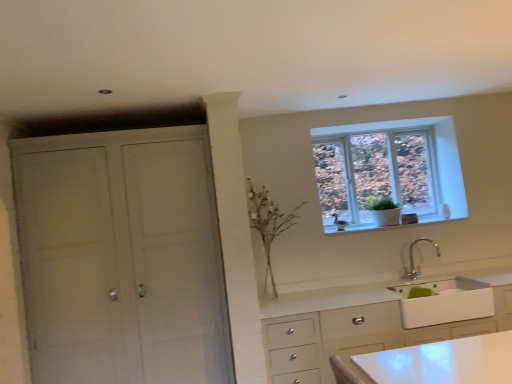
Question: Can you confirm if clear glass window at upper right is bigger than white ceramic window sill at upper right?

Choices:
 (A) no
 (B) yes

Answer: (B)

Question: From a real-world perspective, is clear glass window at upper right over white ceramic window sill at upper right?

Choices:
 (A) no
 (B) yes

Answer: (B)

Question: Can you confirm if clear glass window at upper right is taller than white ceramic window sill at upper right?

Choices:
 (A) no
 (B) yes

Answer: (B)

Question: Is white ceramic window sill at upper right at the back of clear glass window at upper right?

Choices:
 (A) yes
 (B) no

Answer: (B)

Question: Could white ceramic window sill at upper right be considered to be inside clear glass window at upper right?

Choices:
 (A) no
 (B) yes

Answer: (A)

Question: Is white ceramic window sill at upper right in front of or behind white matte cabinet at left in the image?

Choices:
 (A) behind
 (B) front

Answer: (A)

Question: From the image's perspective, is white ceramic window sill at upper right located above or below white matte cabinet at left?

Choices:
 (A) above
 (B) below

Answer: (A)

Question: From a real-world perspective, is white ceramic window sill at upper right positioned above or below white matte cabinet at left?

Choices:
 (A) below
 (B) above

Answer: (B)

Question: In terms of size, does white ceramic window sill at upper right appear bigger or smaller than white matte cabinet at left?

Choices:
 (A) big
 (B) small

Answer: (B)

Question: Considering the positions of white glossy sink at lower right and white matte cabinet at left in the image, is white glossy sink at lower right taller or shorter than white matte cabinet at left?

Choices:
 (A) short
 (B) tall

Answer: (A)

Question: Relative to white matte cabinet at left, is white glossy sink at lower right in front or behind?

Choices:
 (A) front
 (B) behind

Answer: (B)

Question: From a real-world perspective, is white glossy sink at lower right above or below white matte cabinet at left?

Choices:
 (A) below
 (B) above

Answer: (A)

Question: Is white glossy sink at lower right situated inside white matte cabinet at left or outside?

Choices:
 (A) outside
 (B) inside

Answer: (A)

Question: Does point (407, 215) appear closer or farther from the camera than point (415, 276)?

Choices:
 (A) closer
 (B) farther

Answer: (B)

Question: Considering the positions of white ceramic window sill at upper right and silver metallic faucet at lower center in the image, is white ceramic window sill at upper right wider or thinner than silver metallic faucet at lower center?

Choices:
 (A) thin
 (B) wide

Answer: (B)